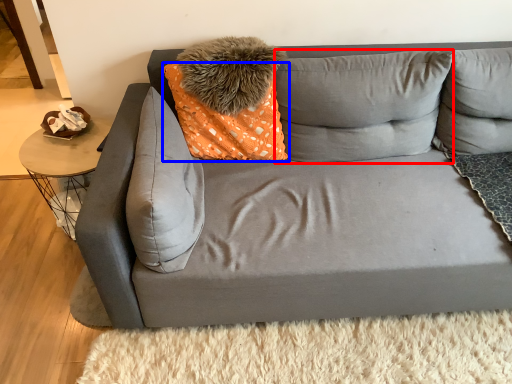
Question: Which object appears closest to the camera in this image, pillow (highlighted by a red box) or pillow (highlighted by a blue box)?

Choices:
 (A) pillow
 (B) pillow

Answer: (B)